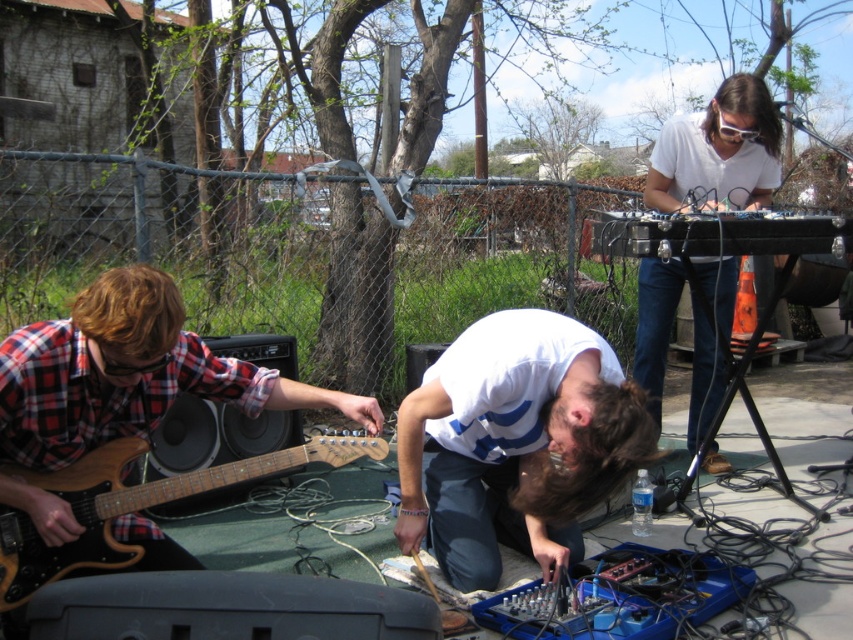
Is white matte shirt at center above wooden electric guitar at lower left?

Correct, white matte shirt at center is located above wooden electric guitar at lower left.

Which is above, white matte shirt at center or wooden electric guitar at lower left?

white matte shirt at center

Who is more forward, (532, 545) or (100, 515)?

Point (100, 515)

What are the coordinates of `white matte shirt at center` in the screenshot? It's located at (515, 444).

Does point (679, 150) come closer to viewer compared to point (219, 477)?

No, it is not.

Which is behind, point (680, 148) or point (80, 481)?

Positioned behind is point (680, 148).

Identify the location of white matte keyboard at upper right. tap(718, 152).

Which of these two, white matte shirt at center or white matte keyboard at upper right, stands taller?

With more height is white matte keyboard at upper right.

Looking at this image, who is more forward, [506,417] or [669,291]?

Point [506,417] is more forward.

Identify the location of white matte shirt at center. This screenshot has width=853, height=640. (515, 444).